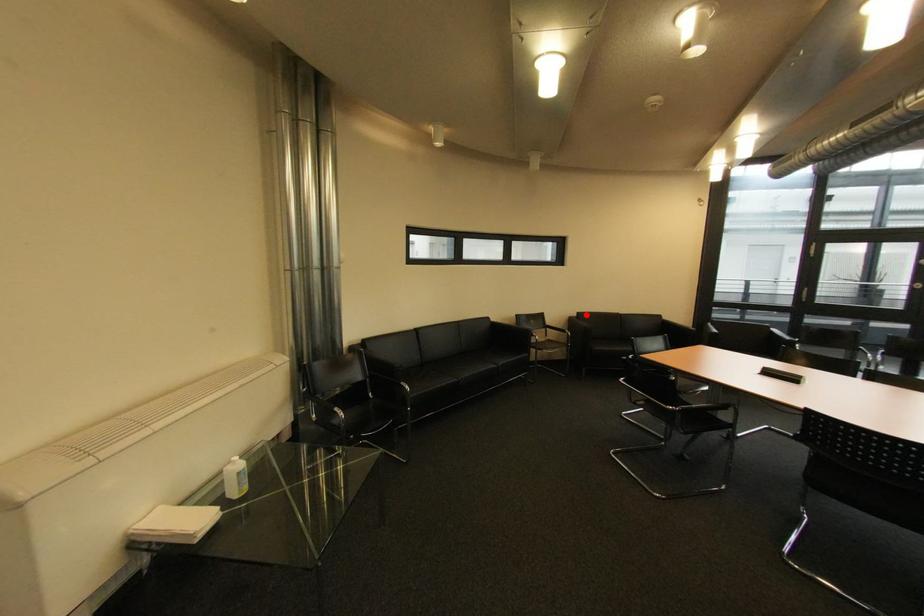
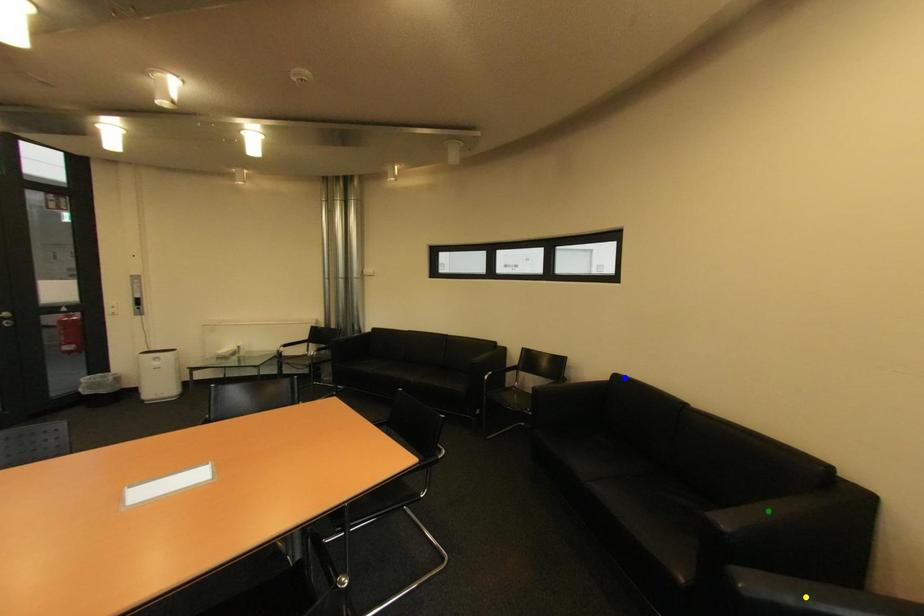
Question: I am providing you with two images of the same scene from different viewpoints. A red point is marked on the first image. You are given multiple points on the second image. Which spot in image 2 lines up with the point in image 1?

Choices:
 (A) blue point
 (B) yellow point
 (C) green point

Answer: (A)